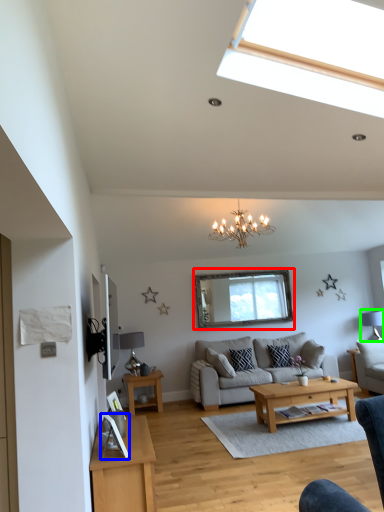
Question: Which is nearer to the window screen (highlighted by a red box)? picture frame (highlighted by a blue box) or lamp (highlighted by a green box).

Choices:
 (A) picture frame
 (B) lamp

Answer: (B)